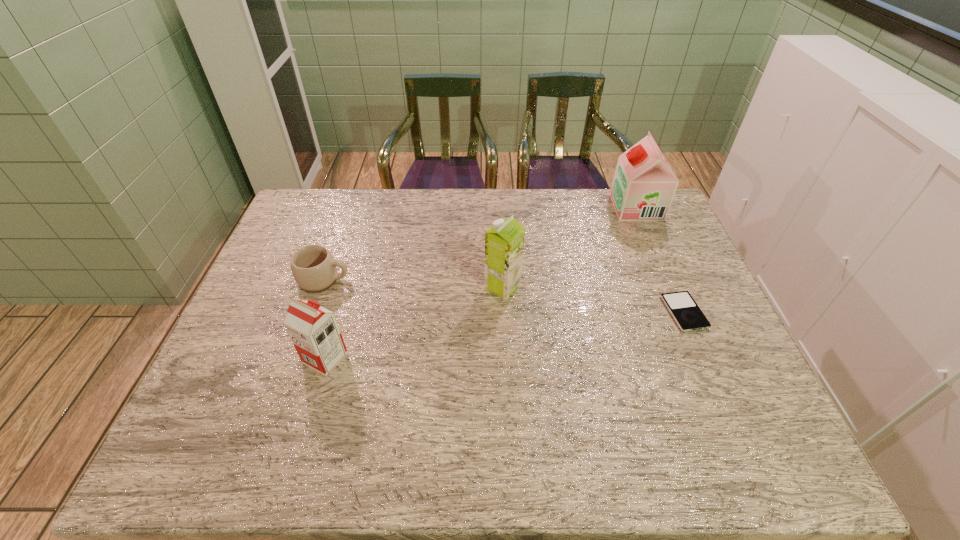
Where is `vacant area located with the cap open on the farthest object`? The image size is (960, 540). vacant area located with the cap open on the farthest object is located at coordinates (523, 207).

Where is `vacant area situated on the left of the second soya milk from left to right`? vacant area situated on the left of the second soya milk from left to right is located at coordinates (440, 287).

The height and width of the screenshot is (540, 960). I want to click on vacant space situated 0.340m on the back of the nearest soya milk, so click(x=356, y=253).

Image resolution: width=960 pixels, height=540 pixels. I want to click on free space located 0.380m on the side of the mug with the handle, so click(478, 280).

What are the coordinates of `vacant area situated 0.080m on the front of the iPod` in the screenshot? It's located at (704, 358).

Locate an element on the screen. object at the far edge is located at coordinates pyautogui.click(x=644, y=185).

Identify the location of object that is at the left edge. (313, 267).

The width and height of the screenshot is (960, 540). I want to click on soya milk present at the right edge, so click(644, 185).

I want to click on iPod located at the right edge, so click(685, 311).

Find the location of `object that is positioned at the far right corner`. object that is positioned at the far right corner is located at coordinates (644, 185).